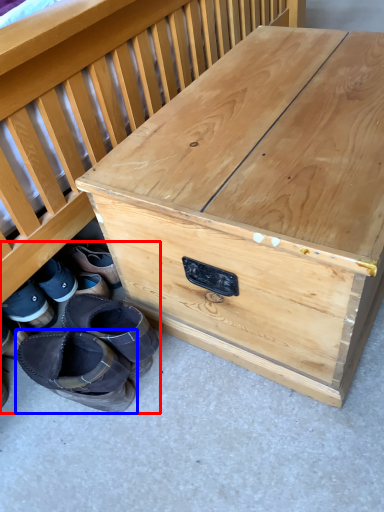
Question: Which point is further to the camera, footwear (highlighted by a red box) or footwear (highlighted by a blue box)?

Choices:
 (A) footwear
 (B) footwear

Answer: (B)